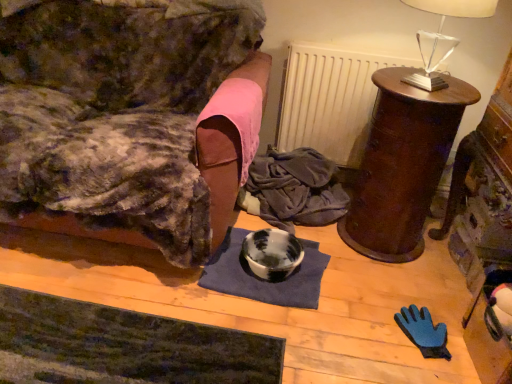
Where is `free point above blue fabric mat at center (from a real-world perspective)`? This screenshot has width=512, height=384. free point above blue fabric mat at center (from a real-world perspective) is located at coordinates (272, 256).